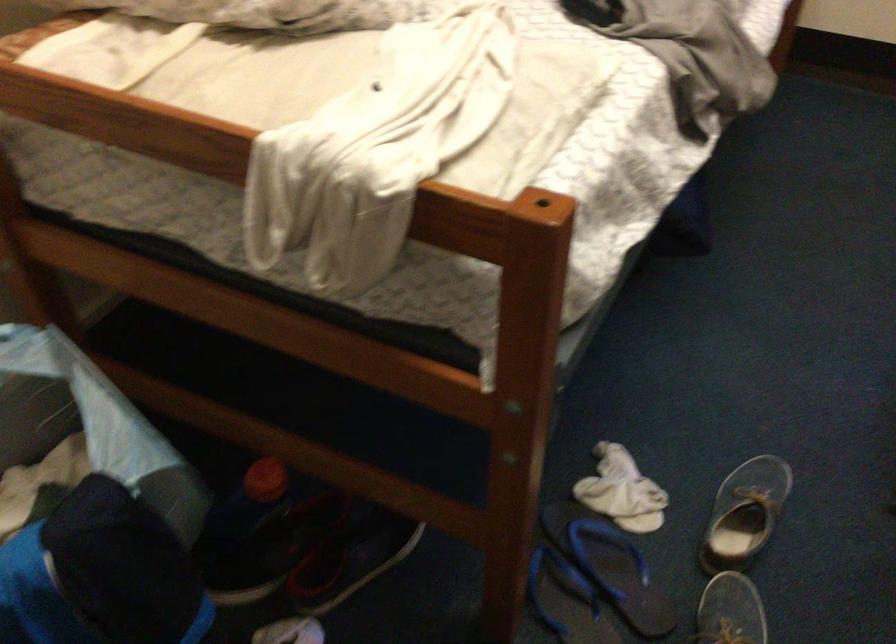
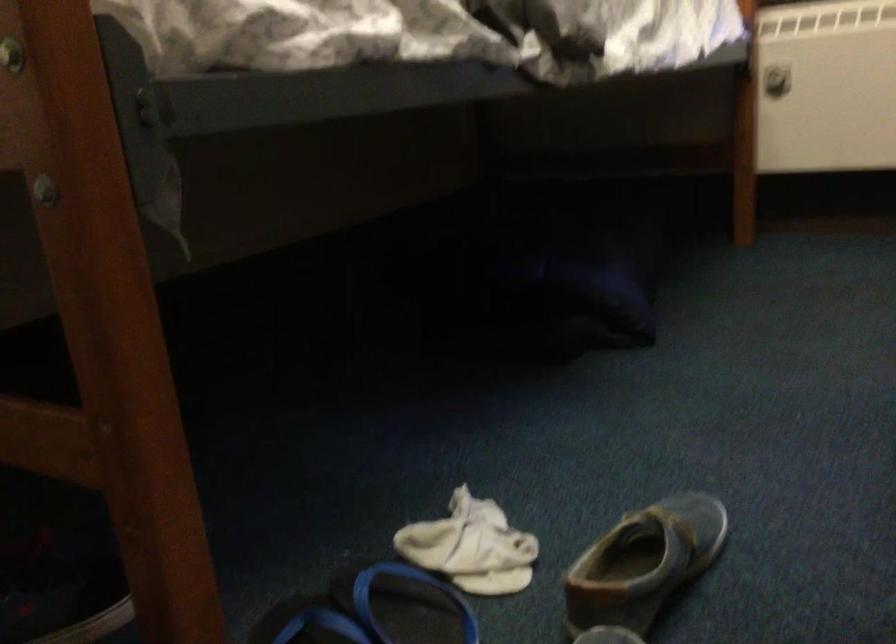
Question: The images are taken continuously from a first-person perspective. In which direction is your viewpoint rotating?

Choices:
 (A) Left
 (B) Right
 (C) Up
 (D) Down

Answer: (C)